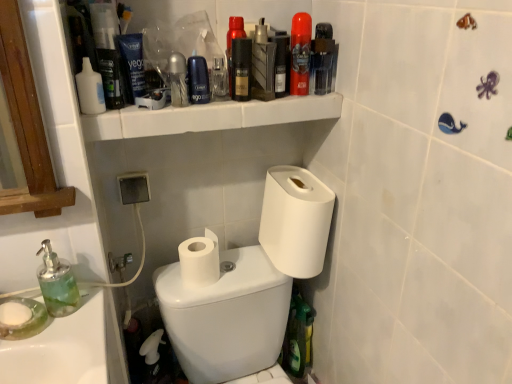
Question: Considering the positions of point (207, 97) and point (321, 36), is point (207, 97) closer or farther from the camera than point (321, 36)?

Choices:
 (A) closer
 (B) farther

Answer: (A)

Question: Looking at their shapes, would you say matte blue shaving cream canister at upper center is wider or thinner than transparent plastic mouthwash at upper right, positioned as the 1th mouthwash in right-to-left order?

Choices:
 (A) wide
 (B) thin

Answer: (B)

Question: Considering the real-world distances, which object is farthest from the white plastic shelf at upper center?

Choices:
 (A) shiny black bottle at upper center, the 6th mouthwash positioned from the right
 (B) matte blue shaving cream canister at upper center
 (C) matte black bottle at center, positioned as the fifth mouthwash in right-to-left order
 (D) translucent green soap dispenser at lower left
 (E) green glass soap dispenser at lower left

Answer: (E)

Question: Which is farther from the matte black bottle at center, acting as the fifth mouthwash starting from the left?

Choices:
 (A) white matte toilet paper at right, acting as the second toilet paper starting from the left
 (B) green glass soap dispenser at lower left
 (C) metallic silver mouthwash at upper center, which appears as the third mouthwash when viewed from the left
 (D) white plastic bottle at upper left, arranged as the first mouthwash when viewed from the left
 (E) shiny black bottle at upper center, the 6th mouthwash positioned from the right

Answer: (B)